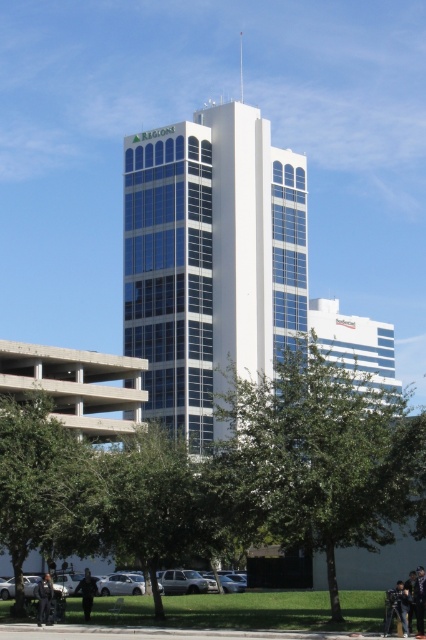
You are standing in the urban landscape and want to take a photo of the green leafy tree at center without the black leather jacket at lower left blocking the view. Is the tree visible without obstruction?

The green leafy tree at center is in front of the black leather jacket at lower left, so the tree is visible and not obstructed by the jacket.

You are a photographer trying to capture the entire Regions Bank skyscraper in your shot. You notice a green leafy tree at center and a black leather jacket at lower left in the frame. Which object would block your view of the skyscraper if placed closer to the camera?

The green leafy tree at center is bigger than the black leather jacket at lower left, so if placed closer to the camera, the green leafy tree at center would block the view of the skyscraper more significantly than the black leather jacket at lower left.

You are a delivery person standing at the base of the Regions Bank skyscraper. You need to place a package next to the green leafy tree at lower center but must avoid leaving it near the dark gray jacket at lower left. Given the distance between them, can you safely place the package near the tree without it being too close to the jacket?

The green leafy tree at lower center and dark gray jacket at lower left are 16.05 feet apart. Since the distance is sufficient, you can safely place the package near the tree without it being too close to the jacket.